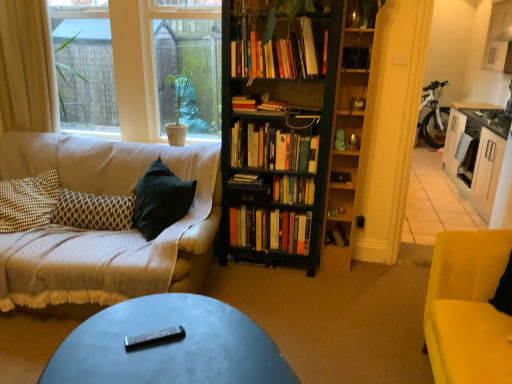
Question: Does hardcover books at center, the 4th book in the top-to-bottom sequence, have a greater height compared to hardcover books at center, which appears as the 3th book when ordered from the bottom?

Choices:
 (A) yes
 (B) no

Answer: (A)

Question: From the image's perspective, is hardcover books at center, positioned as the 5th book in bottom-to-top order, above hardcover books at center, which is the sixth book in top-to-bottom order?

Choices:
 (A) yes
 (B) no

Answer: (A)

Question: From a real-world perspective, is hardcover books at center, positioned as the 5th book in bottom-to-top order, under hardcover books at center, which appears as the 3th book when ordered from the bottom?

Choices:
 (A) no
 (B) yes

Answer: (A)

Question: Is hardcover books at center, positioned as the 5th book in bottom-to-top order, closer to camera compared to hardcover books at center, which appears as the 3th book when ordered from the bottom?

Choices:
 (A) yes
 (B) no

Answer: (A)

Question: Is hardcover books at center, which is the sixth book in top-to-bottom order, inside hardcover books at center, positioned as the 5th book in bottom-to-top order?

Choices:
 (A) no
 (B) yes

Answer: (A)

Question: Considering the positions of black wooden bookcase at center and clear glass window screen at upper left in the image, is black wooden bookcase at center bigger or smaller than clear glass window screen at upper left?

Choices:
 (A) big
 (B) small

Answer: (B)

Question: From a real-world perspective, is black wooden bookcase at center physically located above or below clear glass window screen at upper left?

Choices:
 (A) above
 (B) below

Answer: (B)

Question: Looking at their shapes, would you say black wooden bookcase at center is wider or thinner than clear glass window screen at upper left?

Choices:
 (A) thin
 (B) wide

Answer: (B)

Question: In the image, is black wooden bookcase at center on the left side or the right side of clear glass window screen at upper left?

Choices:
 (A) right
 (B) left

Answer: (A)

Question: Is point (274, 158) closer or farther from the camera than point (102, 210)?

Choices:
 (A) farther
 (B) closer

Answer: (A)

Question: From their relative heights in the image, would you say hardcover books at center, the 4th book in the top-to-bottom sequence, is taller or shorter than patterned fabric pillow at left?

Choices:
 (A) tall
 (B) short

Answer: (B)

Question: From the image's perspective, is hardcover books at center, positioned as the 5th book in bottom-to-top order, located above or below patterned fabric pillow at left?

Choices:
 (A) below
 (B) above

Answer: (B)

Question: Is hardcover books at center, the 4th book in the top-to-bottom sequence, inside the boundaries of patterned fabric pillow at left, or outside?

Choices:
 (A) outside
 (B) inside

Answer: (A)

Question: In the image, is black wooden bookcase at center positioned in front of or behind white fabric curtain at left?

Choices:
 (A) behind
 (B) front

Answer: (B)

Question: From the image's perspective, is black wooden bookcase at center positioned above or below white fabric curtain at left?

Choices:
 (A) above
 (B) below

Answer: (B)